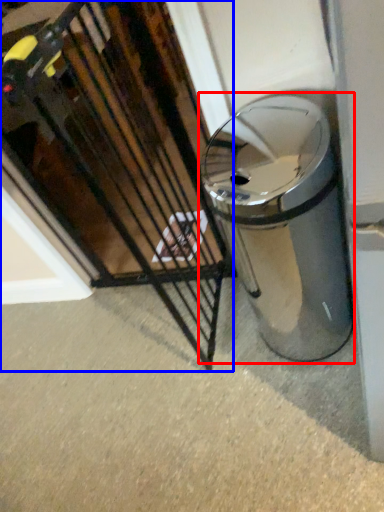
Question: Which object appears farthest to the camera in this image, waste container (highlighted by a red box) or cage (highlighted by a blue box)?

Choices:
 (A) waste container
 (B) cage

Answer: (A)